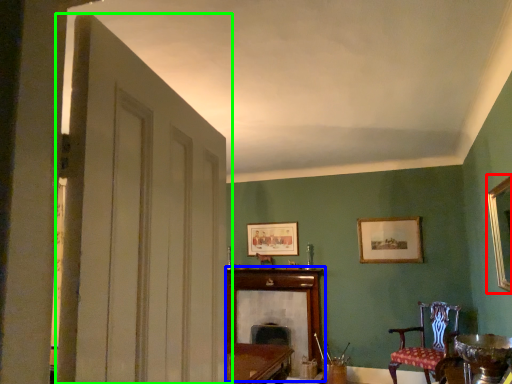
Question: Which object is the closest to the picture frame (highlighted by a red box)? Choose among these: fireplace (highlighted by a blue box) or door (highlighted by a green box).

Choices:
 (A) fireplace
 (B) door

Answer: (B)